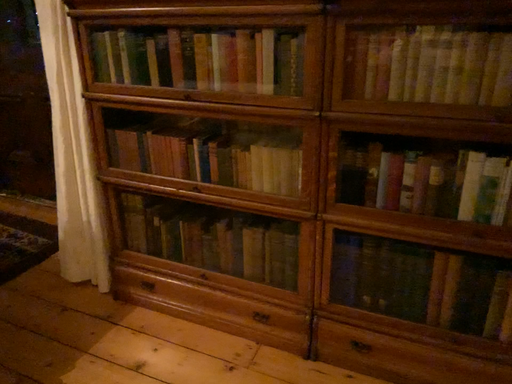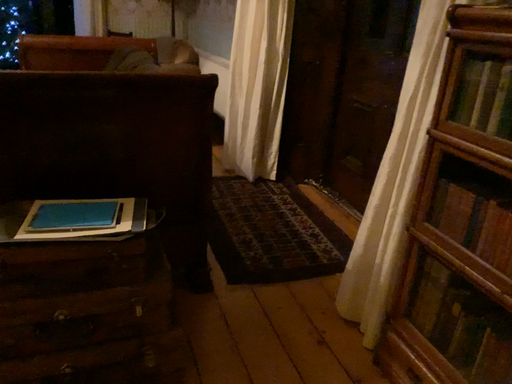
Question: Which way did the camera rotate in the video?

Choices:
 (A) rotated upward
 (B) rotated downward

Answer: (A)